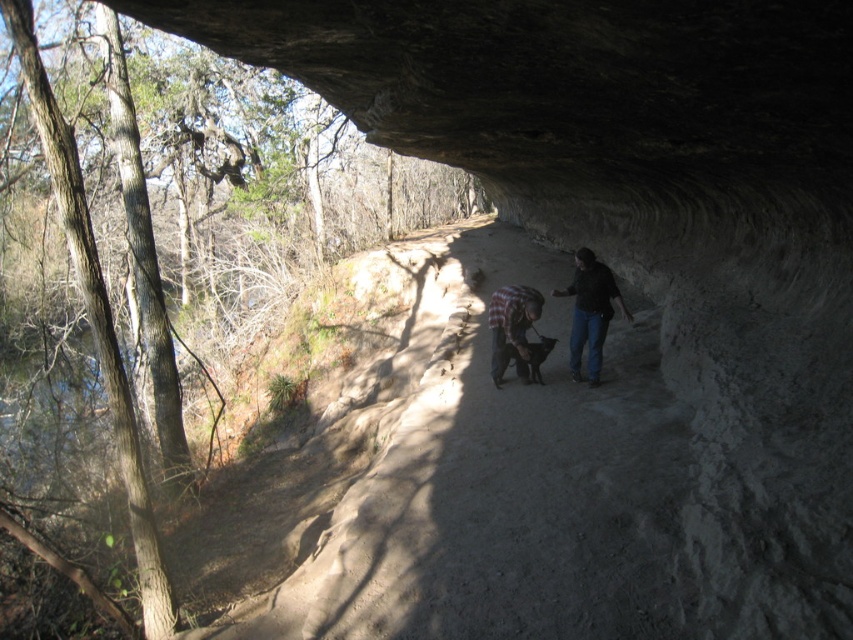
Question: Which point appears closest to the camera in this image?

Choices:
 (A) (534, 348)
 (B) (503, 346)

Answer: (A)

Question: Does dark blue jeans at center have a greater width compared to black fur dog at center?

Choices:
 (A) yes
 (B) no

Answer: (A)

Question: Which of the following is the closest to the observer?

Choices:
 (A) black fur dog at center
 (B) plaid shirt at center

Answer: (B)

Question: Which point is farther to the camera?

Choices:
 (A) (517, 368)
 (B) (496, 344)

Answer: (A)

Question: Is plaid shirt at center below black fur dog at center?

Choices:
 (A) no
 (B) yes

Answer: (A)

Question: Is dark blue jeans at center positioned in front of black fur dog at center?

Choices:
 (A) yes
 (B) no

Answer: (A)